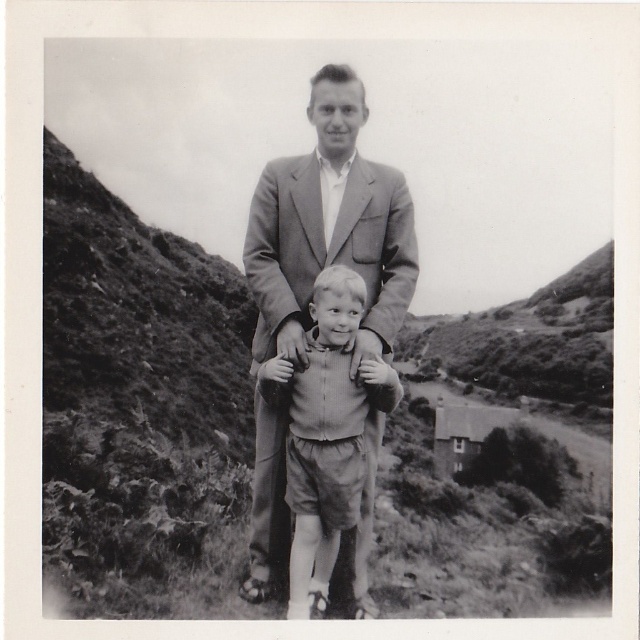
Is point (371, 516) positioned before point (349, 310)?

No.

Consider the image. Who is higher up, smooth gray suit at center or smooth fabric sweater at center?

smooth fabric sweater at center is higher up.

Where is `smooth gray suit at center`? Image resolution: width=640 pixels, height=640 pixels. smooth gray suit at center is located at coordinates (330, 228).

Between grassy hillside at center and smooth gray suit at center, which one appears on the right side from the viewer's perspective?

Positioned to the right is grassy hillside at center.

Does grassy hillside at center appear on the right side of smooth gray suit at center?

Indeed, grassy hillside at center is positioned on the right side of smooth gray suit at center.

Image resolution: width=640 pixels, height=640 pixels. Find the location of `grassy hillside at center`. grassy hillside at center is located at coordinates (138, 394).

How distant is grassy hillside at center from smooth fabric sweater at center?

grassy hillside at center and smooth fabric sweater at center are 27.34 meters apart from each other.

The image size is (640, 640). What do you see at coordinates (138, 394) in the screenshot?
I see `grassy hillside at center` at bounding box center [138, 394].

This screenshot has height=640, width=640. I want to click on grassy hillside at center, so click(138, 394).